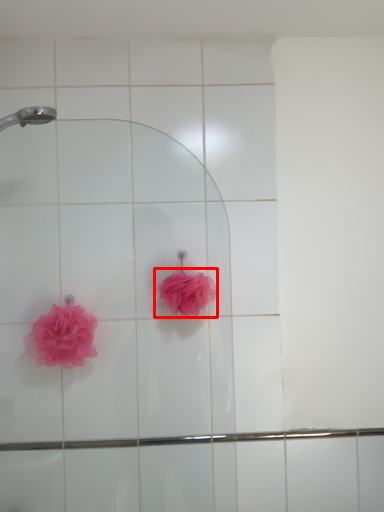
Question: Observing the image, what is the correct spatial positioning of rose (annotated by the red box) in reference to rose?

Choices:
 (A) right
 (B) left

Answer: (A)